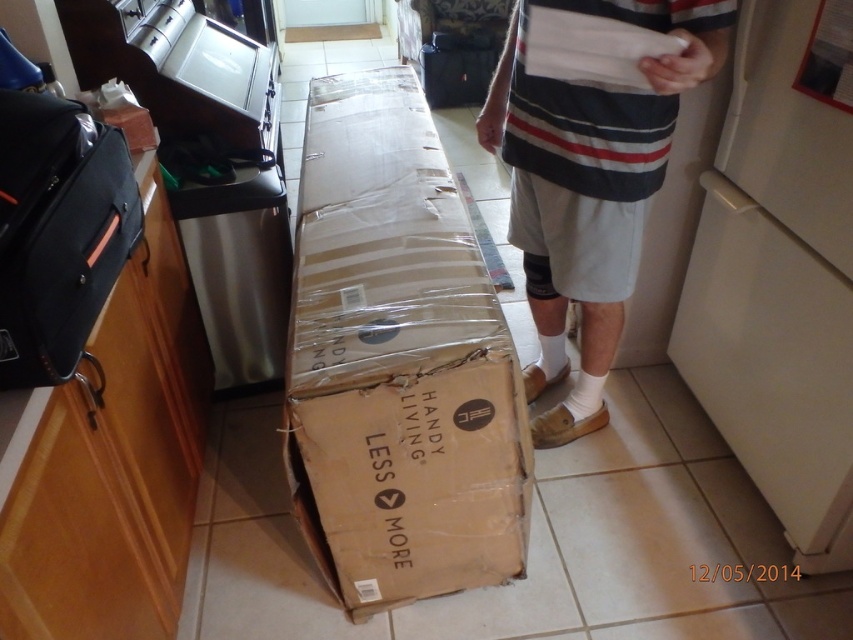
Can you confirm if brown cardboard box at center is bigger than white striped shorts at center?

Indeed, brown cardboard box at center has a larger size compared to white striped shorts at center.

From the picture: Is brown cardboard box at center below white striped shorts at center?

Indeed, brown cardboard box at center is positioned under white striped shorts at center.

Measure the distance between point (322, 449) and camera.

They are 1.20 meters apart.

Find the location of a particular element. The height and width of the screenshot is (640, 853). brown cardboard box at center is located at coordinates (397, 362).